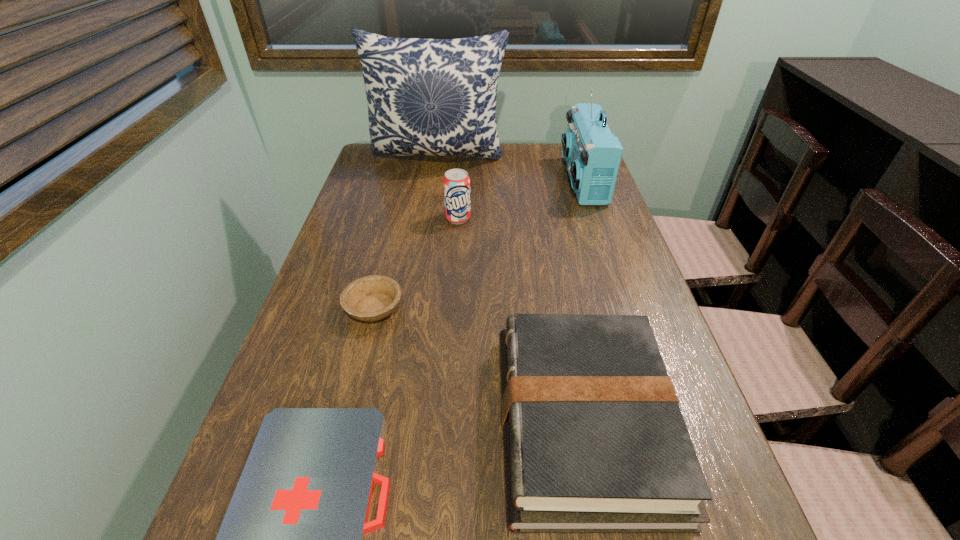
Where is `radio receiver that is positioned at the right edge`? radio receiver that is positioned at the right edge is located at coordinates (592, 153).

The height and width of the screenshot is (540, 960). What are the coordinates of `hardback book that is at the right edge` in the screenshot? It's located at (594, 439).

The height and width of the screenshot is (540, 960). Identify the location of object situated at the far left corner. (433, 97).

The width and height of the screenshot is (960, 540). I want to click on object at the far right corner, so click(592, 153).

This screenshot has width=960, height=540. I want to click on vacant region at the far edge of the desktop, so click(x=462, y=156).

Identify the location of vacant space at the left edge of the desktop. (371, 228).

Locate an element on the screen. Image resolution: width=960 pixels, height=540 pixels. empty location between the hardback book and the tallest object is located at coordinates (511, 290).

You are a GUI agent. You are given a task and a screenshot of the screen. Output one action in this format:
    pyautogui.click(x=<x>, y=<y>)
    Task: Click on the free point between the second tallest object and the tallest object
    This screenshot has width=960, height=540.
    Given the screenshot: What is the action you would take?
    pyautogui.click(x=511, y=170)

Where is `free area in between the fourth farthest object and the tallest object`? free area in between the fourth farthest object and the tallest object is located at coordinates (406, 233).

You are a GUI agent. You are given a task and a screenshot of the screen. Output one action in this format:
    pyautogui.click(x=<x>, y=<y>)
    Task: Click on the empty space that is in between the bowl and the tallest object
    The height and width of the screenshot is (540, 960).
    Given the screenshot: What is the action you would take?
    pyautogui.click(x=406, y=233)